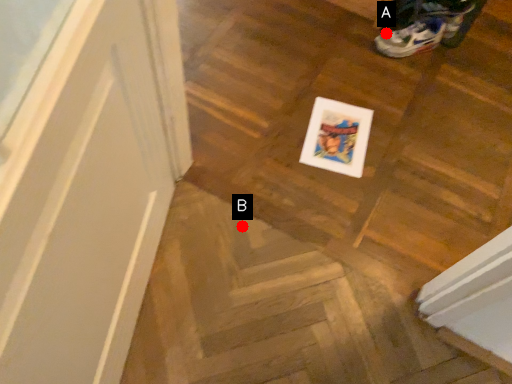
Question: Two points are circled on the image, labeled by A and B beside each circle. Which point is closer to the camera?

Choices:
 (A) A is closer
 (B) B is closer

Answer: (B)